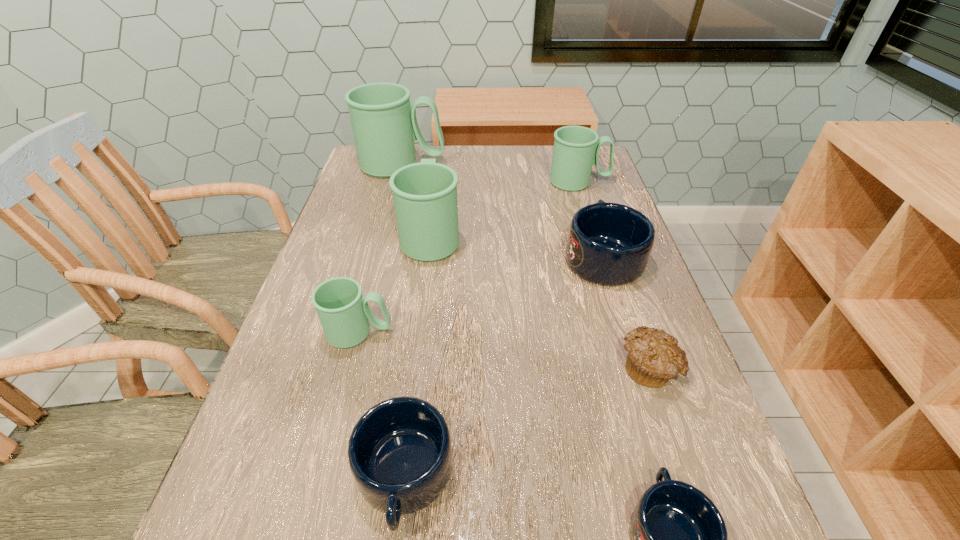
Find the location of `object that is at the far left corner`. object that is at the far left corner is located at coordinates (384, 123).

Where is `object that is positioned at the far right corner`? This screenshot has height=540, width=960. object that is positioned at the far right corner is located at coordinates (576, 148).

In the image, there is a desktop. In order to click on free space at the far edge in this screenshot , I will do `click(498, 152)`.

Find the location of a particular element. The image size is (960, 540). blank space at the left edge is located at coordinates (372, 233).

Locate an element on the screen. free space at the right edge of the desktop is located at coordinates (595, 194).

At what (x,y) coordinates should I click in order to perform the action: click on unoccupied position between the fifth farthest mug and the third farthest green mug. Please return your answer as a coordinate pair (x, y). Image resolution: width=960 pixels, height=540 pixels. Looking at the image, I should click on (396, 284).

Where is `free space that is in between the third tallest object and the smallest green mug`? free space that is in between the third tallest object and the smallest green mug is located at coordinates (469, 257).

Identify which object is the fifth closest to the leftmost blue mug. Please provide its 2D coordinates. Your answer should be formatted as a tuple, i.e. [(x, y)], where the tuple contains the x and y coordinates of a point satisfying the conditions above.

[(425, 194)]

Point out which object is positioned as the fourth nearest to the farthest blue mug. Please provide its 2D coordinates. Your answer should be formatted as a tuple, i.e. [(x, y)], where the tuple contains the x and y coordinates of a point satisfying the conditions above.

[(343, 312)]

Locate an element on the screen. mug object that ranks as the fourth closest to the nearest green mug is located at coordinates (679, 538).